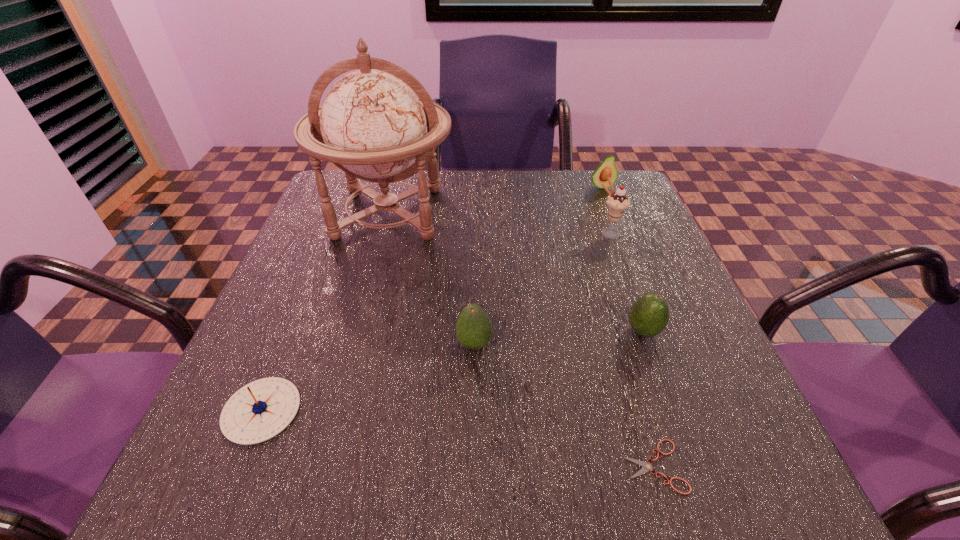
Identify the location of blank space located on the right of the compass. (438, 410).

At what (x,y) coordinates should I click in order to perform the action: click on vacant space situated 0.100m on the left of the shortest object. Please return your answer as a coordinate pair (x, y). Image resolution: width=960 pixels, height=540 pixels. Looking at the image, I should click on (556, 466).

Locate an element on the screen. Image resolution: width=960 pixels, height=540 pixels. globe located at the far edge is located at coordinates (371, 125).

Where is `avocado that is at the far edge`? avocado that is at the far edge is located at coordinates (607, 168).

Locate an element on the screen. This screenshot has height=540, width=960. compass positioned at the near edge is located at coordinates (260, 410).

You are a GUI agent. You are given a task and a screenshot of the screen. Output one action in this format:
    pyautogui.click(x=<x>, y=<y>)
    Task: Click on the shears present at the near edge
    
    Given the screenshot: What is the action you would take?
    pyautogui.click(x=647, y=467)

The width and height of the screenshot is (960, 540). What are the coordinates of `globe positioned at the left edge` in the screenshot? It's located at (371, 125).

Image resolution: width=960 pixels, height=540 pixels. Identify the location of compass positioned at the left edge. (260, 410).

Locate an element on the screen. The width and height of the screenshot is (960, 540). icecream that is at the right edge is located at coordinates (617, 202).

Locate an element on the screen. This screenshot has width=960, height=540. shears located in the right edge section of the desktop is located at coordinates (647, 467).